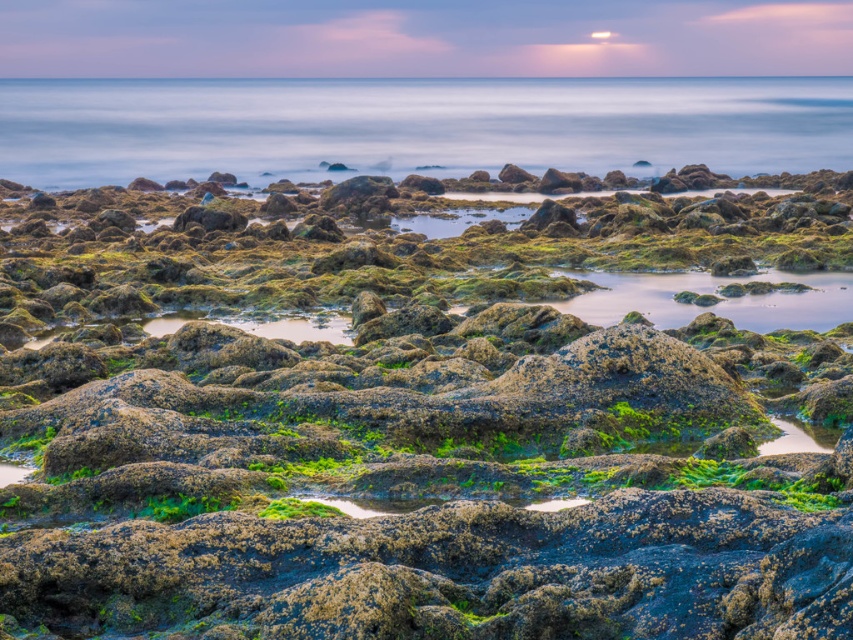
Question: Is green mossy rock at center positioned before smooth water at center?

Choices:
 (A) no
 (B) yes

Answer: (B)

Question: Is green mossy rock at center wider than smooth water at center?

Choices:
 (A) no
 (B) yes

Answer: (A)

Question: Which point appears farthest from the camera in this image?

Choices:
 (A) (621, 154)
 (B) (103, 342)

Answer: (A)

Question: Does green mossy rock at center have a larger size compared to smooth water at center?

Choices:
 (A) no
 (B) yes

Answer: (A)